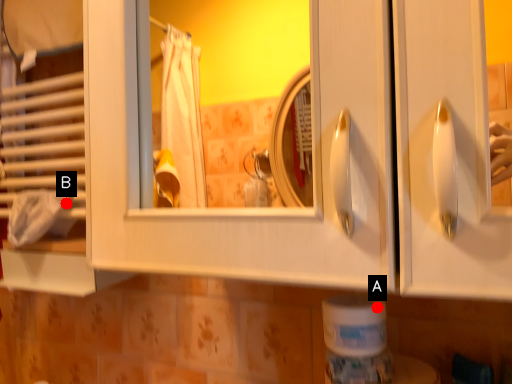
Question: Two points are circled on the image, labeled by A and B beside each circle. Which point is further to the camera?

Choices:
 (A) A is further
 (B) B is further

Answer: (B)